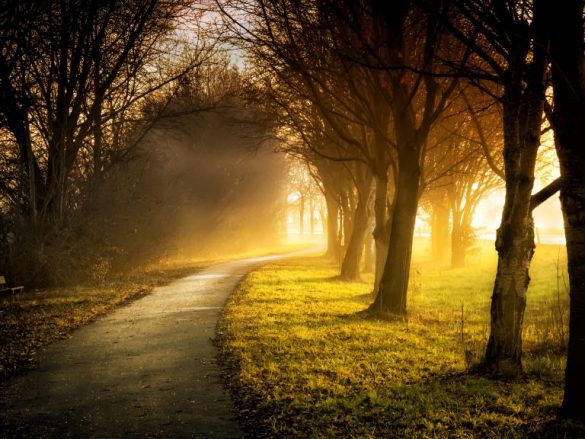
The image size is (585, 439). I want to click on bench, so click(x=16, y=293).